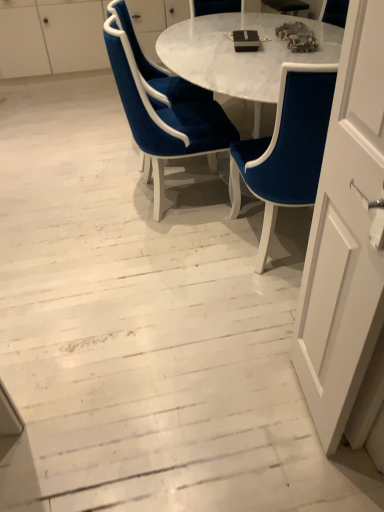
Locate an element on the screen. The height and width of the screenshot is (512, 384). vacant area situated to the left side of velvet blue chair at center, arranged as the 3th chair when viewed from the right is located at coordinates (89, 153).